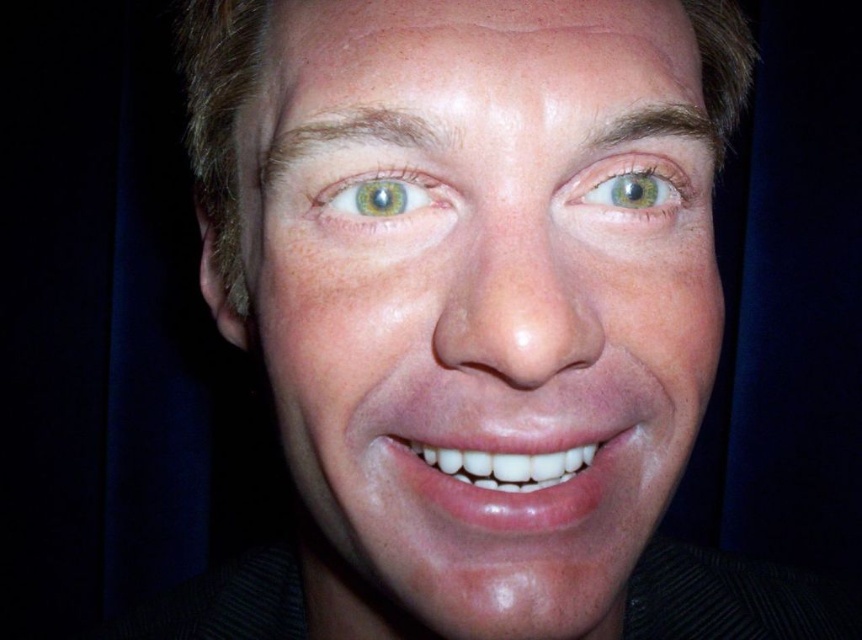
You are a photographer adjusting the focus on your camera. You need to focus on two points in the image, point [453,92] and point [684,176]. Which point should you focus on first to ensure the closest object is sharp?

Point [453,92] is closer to the viewer than point [684,176], so you should focus on point [453,92] first to ensure the closest object is sharp.

You are a makeup artist preparing to apply eyeliner to the green matte eye at center. You need to ensure the eyeliner is applied above the smooth skin face at center. Is this possible given their positions?

The smooth skin face at center is located below the green matte eye at center, so yes, the eyeliner can be applied above the smooth skin face at center since the green matte eye at center is positioned above it.